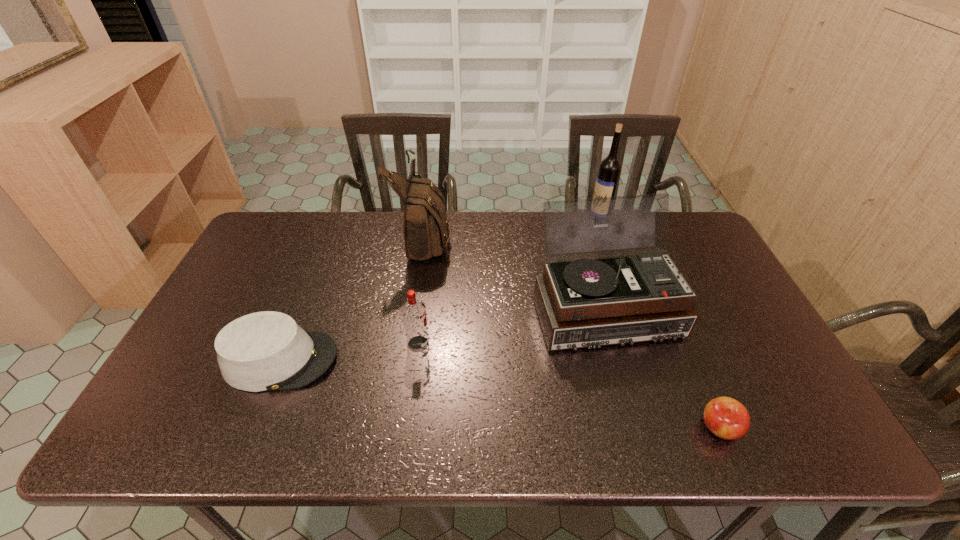
Where is `vacant space that is in between the nearest object and the vodka`? This screenshot has height=540, width=960. vacant space that is in between the nearest object and the vodka is located at coordinates (569, 386).

Identify the location of unoccupied area between the hat and the vodka. The width and height of the screenshot is (960, 540). (349, 352).

Identify the location of free space between the nearest object and the fifth tallest object. (500, 394).

The image size is (960, 540). Find the location of `object identified as the closest to the shoulder bag`. object identified as the closest to the shoulder bag is located at coordinates (x=588, y=302).

I want to click on object that can be found as the fourth closest to the hat, so click(725, 417).

The width and height of the screenshot is (960, 540). Identify the location of vacant position in the image that satisfies the following two spatial constraints: 1. on the front side of the nearest object; 2. on the left side of the record player. (637, 428).

Image resolution: width=960 pixels, height=540 pixels. In order to click on free location that satisfies the following two spatial constraints: 1. on the front-facing side of the shoulder bag; 2. on the left side of the record player in this screenshot , I will do `click(414, 308)`.

What are the coordinates of `blank area in the image that satisfies the following two spatial constraints: 1. on the front-facing side of the shoulder bag; 2. on the left side of the nearest object` in the screenshot? It's located at (396, 428).

Identify the location of vacant space that satisfies the following two spatial constraints: 1. on the front-facing side of the shoulder bag; 2. on the right side of the apple. The height and width of the screenshot is (540, 960). (396, 428).

The image size is (960, 540). What are the coordinates of `free space in the image that satisfies the following two spatial constraints: 1. on the front-facing side of the shoulder bag; 2. on the left side of the nearest object` in the screenshot? It's located at 396,428.